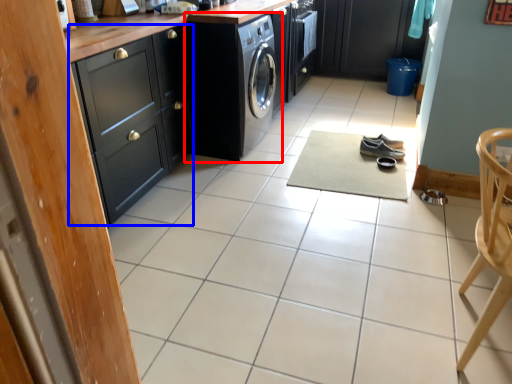
Question: Which object appears farthest to the camera in this image, washing machine (highlighted by a red box) or cabinetry (highlighted by a blue box)?

Choices:
 (A) washing machine
 (B) cabinetry

Answer: (A)